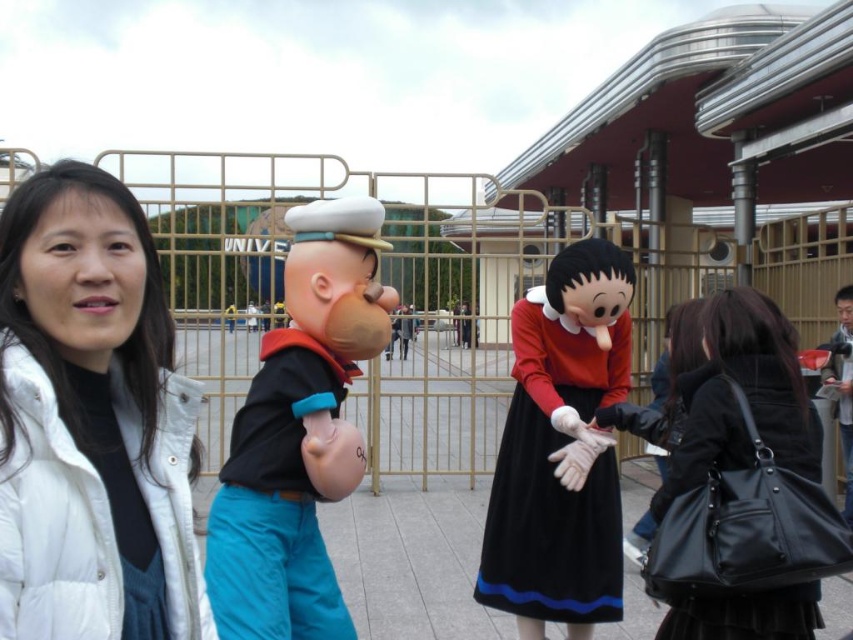
Is point (532, 513) positioned in front of point (341, 625)?

No.

Between point (606, 560) and point (329, 376), which one is positioned behind?

Point (606, 560)

Where is `velvet black dress at center`? This screenshot has width=853, height=640. velvet black dress at center is located at coordinates click(x=561, y=449).

Does velvet black dress at center come in front of black leather bag at lower right?

No, velvet black dress at center is further to the viewer.

Is velvet black dress at center thinner than black leather bag at lower right?

In fact, velvet black dress at center might be wider than black leather bag at lower right.

You are a GUI agent. You are given a task and a screenshot of the screen. Output one action in this format:
    pyautogui.click(x=<x>, y=<y>)
    Task: Click on the velvet black dress at center
    The width and height of the screenshot is (853, 640).
    Given the screenshot: What is the action you would take?
    pyautogui.click(x=561, y=449)

Who is more forward, (157, 451) or (612, 362)?

Point (157, 451)

Between white down jacket at left and velvet black dress at center, which one is positioned higher?

Positioned higher is white down jacket at left.

Image resolution: width=853 pixels, height=640 pixels. Find the location of `white down jacket at left`. white down jacket at left is located at coordinates (91, 422).

Where is `white down jacket at left`? white down jacket at left is located at coordinates (91, 422).